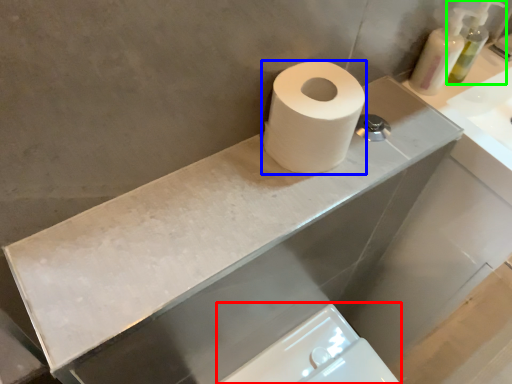
Question: Estimate the real-world distances between objects in this image. Which object is closer to bidet (highlighted by a red box), toilet paper (highlighted by a blue box) or soap dispenser (highlighted by a green box)?

Choices:
 (A) toilet paper
 (B) soap dispenser

Answer: (A)